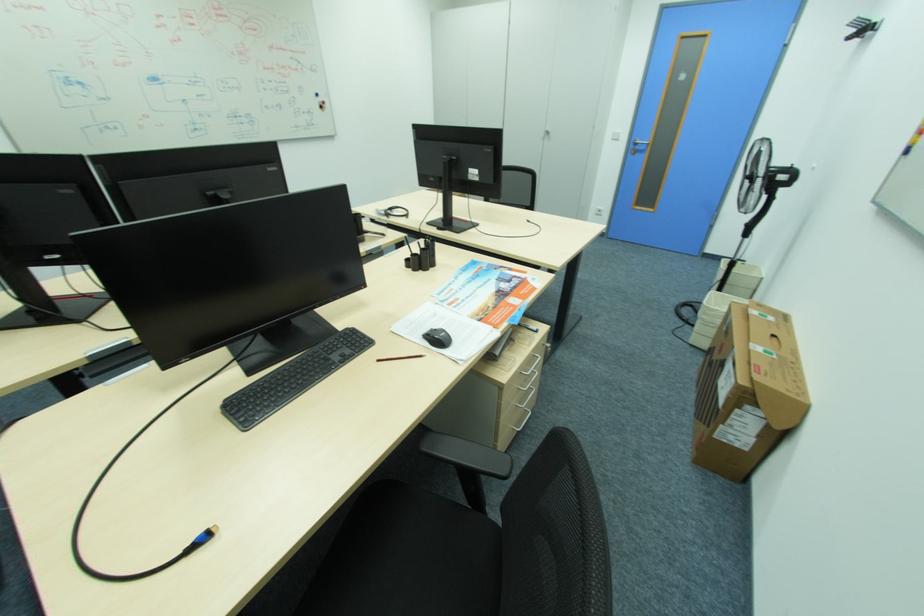
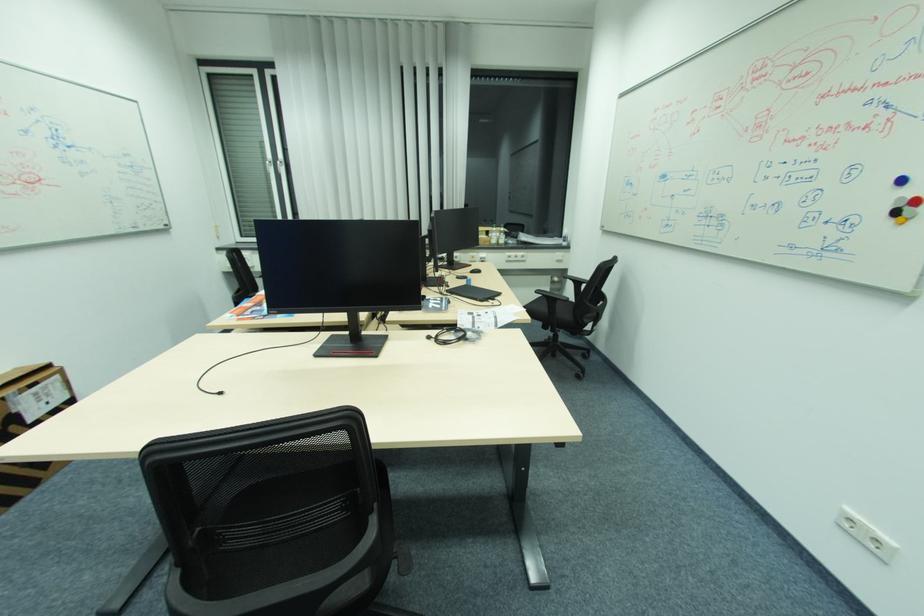
Find the pixel in the second image that matches pixel 327 105 in the first image.

(907, 206)